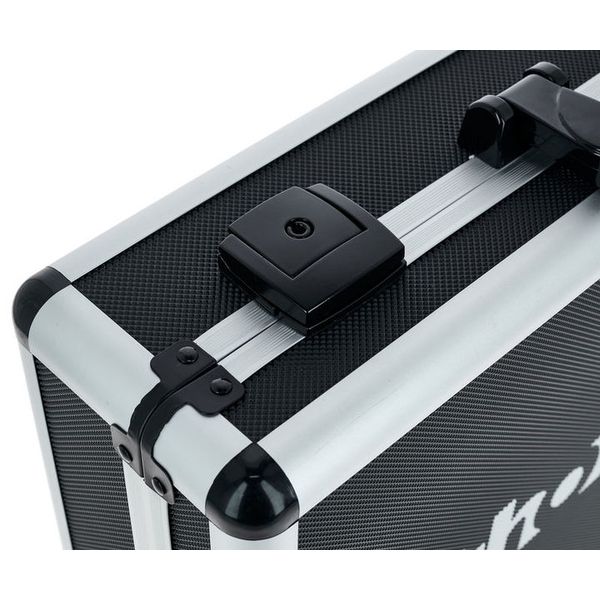
Where is `lock hole`? lock hole is located at coordinates (302, 232).